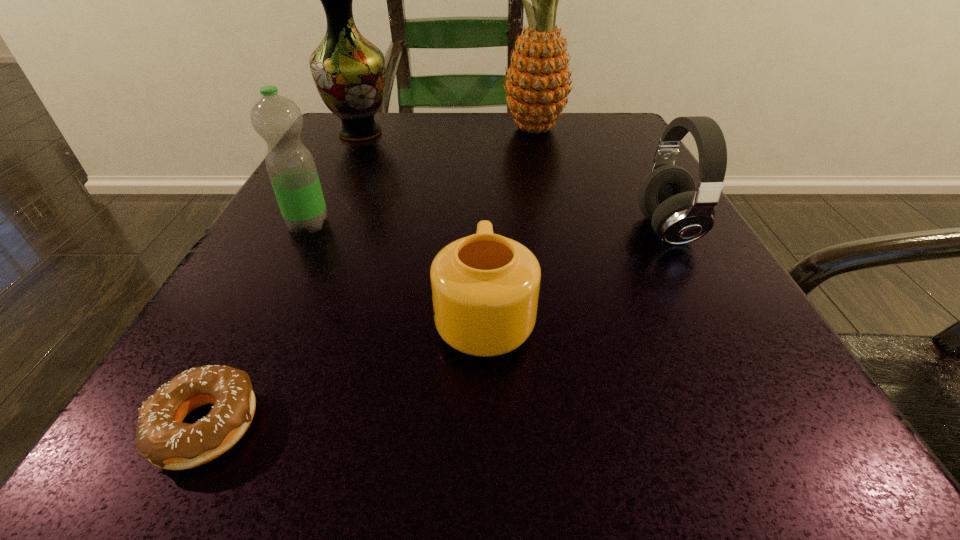
You are a GUI agent. You are given a task and a screenshot of the screen. Output one action in this format:
    pyautogui.click(x=<x>, y=<y>)
    Task: Click on the free spot between the nearest object and the water bottle
    
    Given the screenshot: What is the action you would take?
    pyautogui.click(x=257, y=325)

The image size is (960, 540). Identify the location of vacant point located between the vase and the water bottle. pyautogui.click(x=334, y=179).

Locate an element on the screen. vacant point located between the shortest object and the pineapple is located at coordinates (370, 278).

This screenshot has height=540, width=960. I want to click on blank region between the vase and the tallest object, so click(446, 131).

Where is `free space between the pineapple and the second tallest object`? The image size is (960, 540). free space between the pineapple and the second tallest object is located at coordinates (446, 131).

The image size is (960, 540). What are the coordinates of `free space between the water bottle and the vase` in the screenshot? It's located at click(334, 179).

This screenshot has width=960, height=540. What are the coordinates of `empty space between the tallest object and the rightmost object` in the screenshot? It's located at [x=599, y=179].

Choose which object is the fourth nearest neighbor to the pineapple. Please provide its 2D coordinates. Your answer should be formatted as a tuple, i.e. [(x, y)], where the tuple contains the x and y coordinates of a point satisfying the conditions above.

[(485, 287)]

Locate an element on the screen. This screenshot has width=960, height=540. object that is the second closest to the doughnut is located at coordinates (278, 120).

Where is `free region that satisfies the following two spatial constraints: 1. on the handle side of the fifth farthest object; 2. on the right side of the pineapple`? The width and height of the screenshot is (960, 540). free region that satisfies the following two spatial constraints: 1. on the handle side of the fifth farthest object; 2. on the right side of the pineapple is located at coordinates (483, 129).